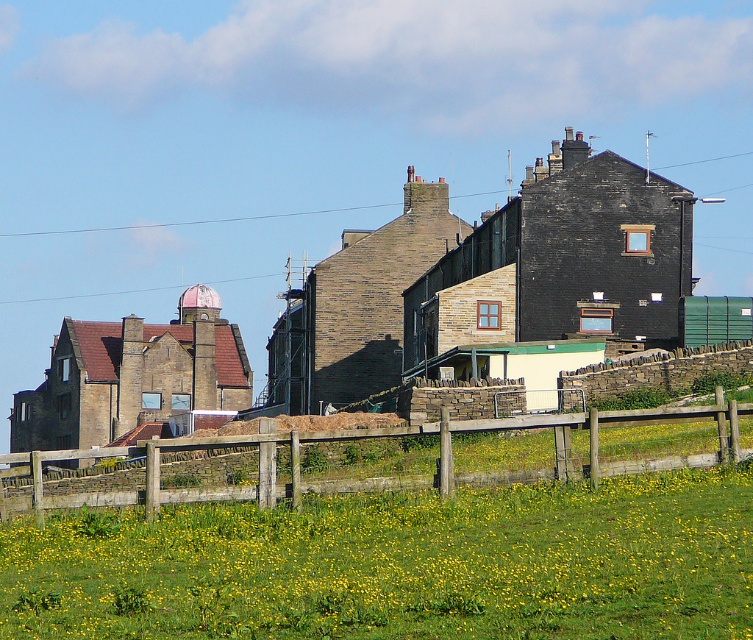
Between green grassy field at lower center and wooden fence at lower center, which one appears on the right side from the viewer's perspective?

Positioned to the right is wooden fence at lower center.

Is point (517, 548) less distant than point (584, 460)?

Yes, it is in front of point (584, 460).

The image size is (753, 640). Find the location of `green grassy field at lower center`. green grassy field at lower center is located at coordinates (398, 564).